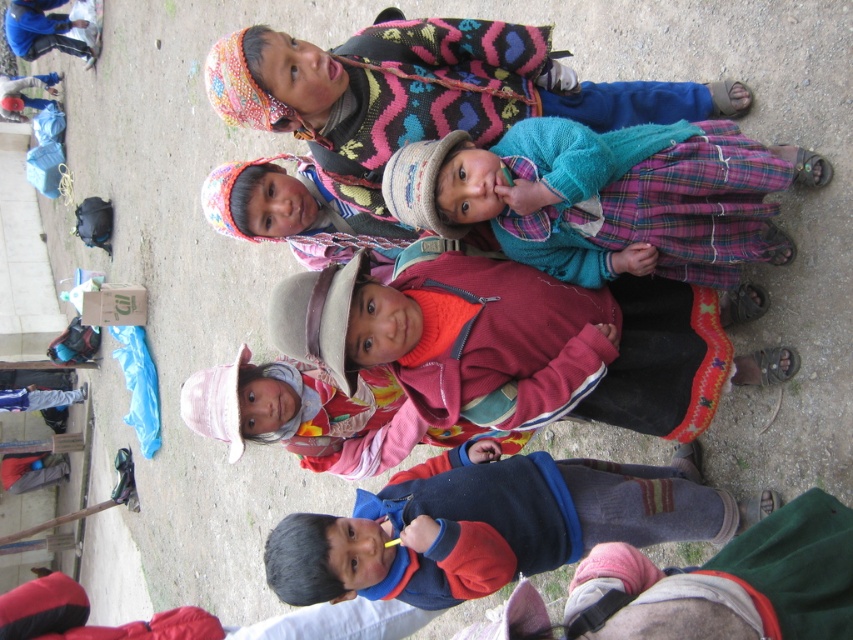
Question: Is knitted teal sweater at center below dark blue sweater at center?

Choices:
 (A) yes
 (B) no

Answer: (B)

Question: Which point appears closest to the camera in this image?

Choices:
 (A) (695, 486)
 (B) (227, 173)
 (C) (403, 296)

Answer: (C)

Question: Where is knitted teal sweater at center located in relation to dark blue sweater at center in the image?

Choices:
 (A) below
 (B) above

Answer: (B)

Question: Among these objects, which one is nearest to the camera?

Choices:
 (A) plaid fabric baby at center
 (B) multicolored woven hat at center
 (C) knitted multicolor sweater at upper center

Answer: (C)

Question: Does knitted multicolor sweater at upper center appear under multicolored woven hat at center?

Choices:
 (A) no
 (B) yes

Answer: (A)

Question: Which point is closer to the camera?

Choices:
 (A) (741, 195)
 (B) (265, 372)

Answer: (A)